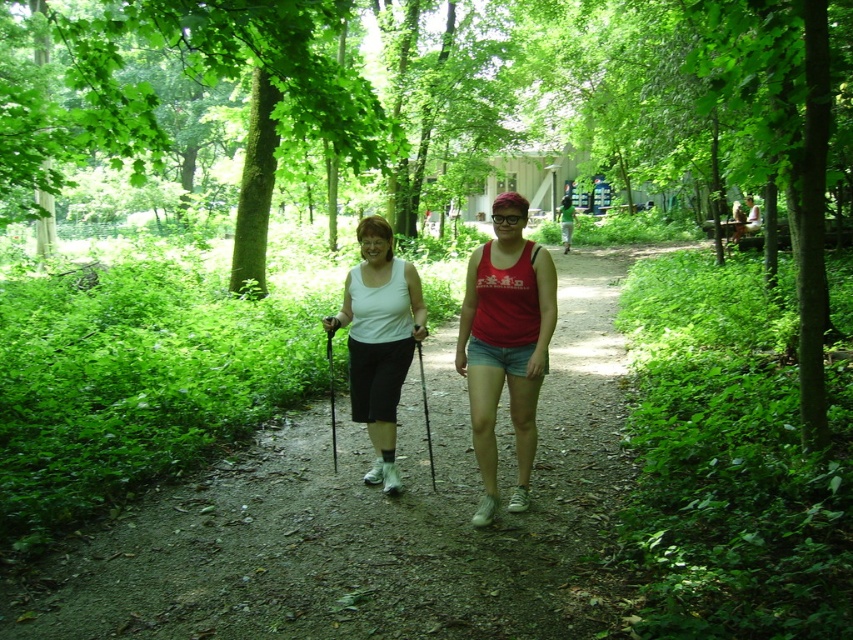
Which is in front, point (488, 355) or point (392, 467)?

Point (488, 355) is more forward.

Is point (492, 435) positioned after point (395, 401)?

No, it is in front of (395, 401).

Locate an element on the screen. red cotton tank top at center is located at coordinates (505, 342).